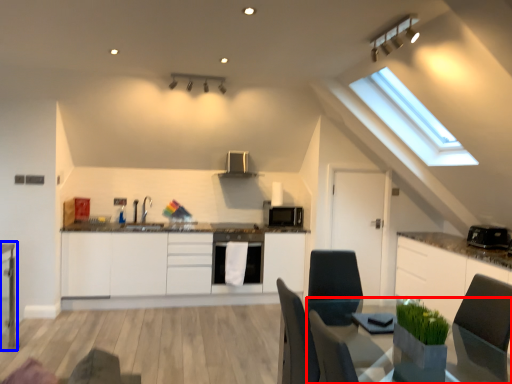
Question: Which object appears farthest to the camera in this image, table (highlighted by a red box) or table (highlighted by a blue box)?

Choices:
 (A) table
 (B) table

Answer: (B)